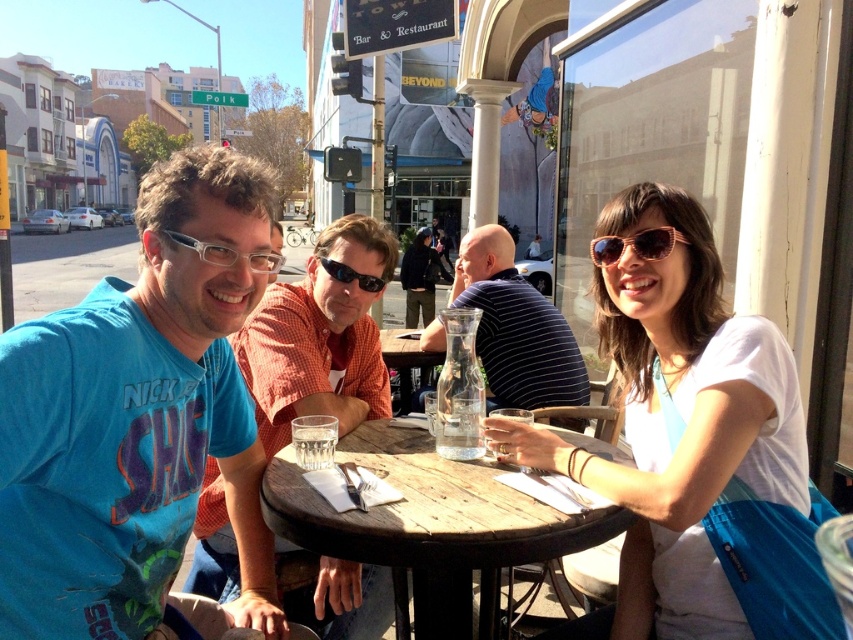
Question: Based on their relative distances, which object is farther from the pink acetate sunglasses at upper right?

Choices:
 (A) clear plastic glasses at center
 (B) striped cotton shirt at center
 (C) clear glass carafe at center
 (D) white matte shirt at center

Answer: (B)

Question: Among these objects, which one is nearest to the camera?

Choices:
 (A) black plastic sunglasses at center
 (B) clear glass carafe at center
 (C) clear plastic glasses at center
 (D) striped cotton shirt at center

Answer: (C)

Question: Is blue cotton shirt at left smaller than clear glass at table center?

Choices:
 (A) yes
 (B) no

Answer: (B)

Question: Does blue cotton shirt at left have a larger size compared to clear plastic glasses at center?

Choices:
 (A) no
 (B) yes

Answer: (B)

Question: Which point is farther to the camera?

Choices:
 (A) coord(300,508)
 (B) coord(264,256)

Answer: (B)

Question: Does white matte shirt at center appear on the left side of striped cotton shirt at center?

Choices:
 (A) no
 (B) yes

Answer: (A)